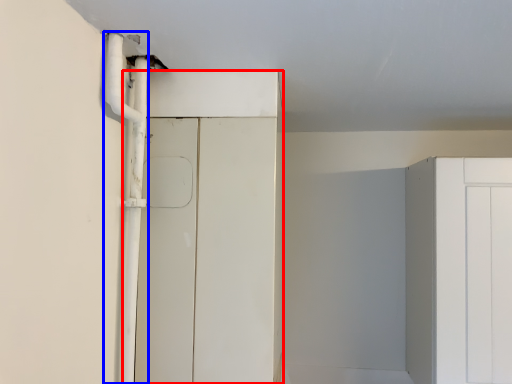
Question: Which object appears closest to the camera in this image, door (highlighted by a red box) or pipe (highlighted by a blue box)?

Choices:
 (A) door
 (B) pipe

Answer: (B)